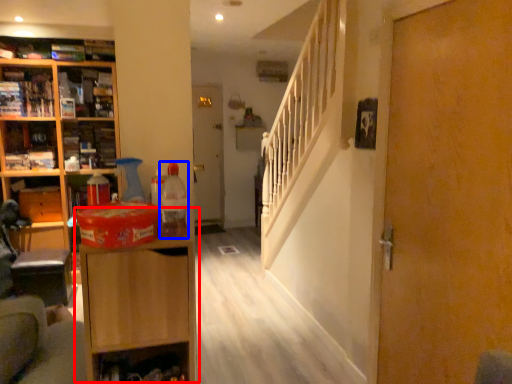
Question: Which point is closer to the camera, cabinetry (highlighted by a red box) or bottle (highlighted by a blue box)?

Choices:
 (A) cabinetry
 (B) bottle

Answer: (A)